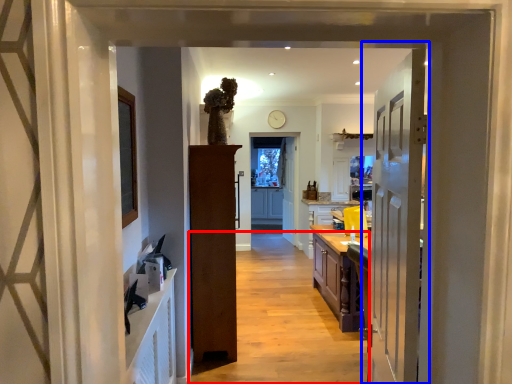
Question: Which object appears farthest to the camera in this image, path (highlighted by a red box) or door (highlighted by a blue box)?

Choices:
 (A) path
 (B) door

Answer: (A)